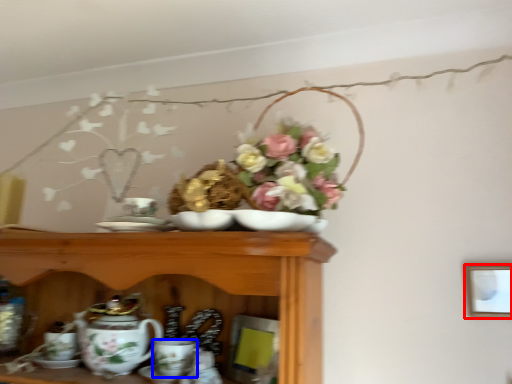
Question: Which object appears closest to the camera in this image, picture frame (highlighted by a red box) or coffee cup (highlighted by a blue box)?

Choices:
 (A) picture frame
 (B) coffee cup

Answer: (B)